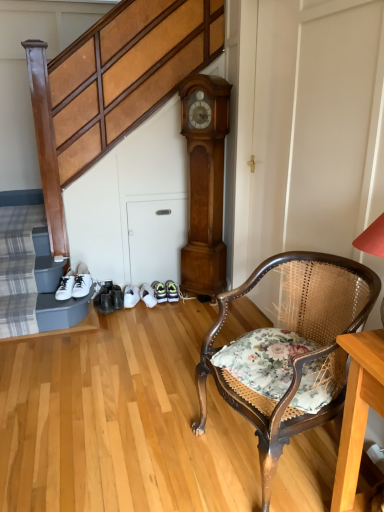
Question: In the image, is light brown wood clock at center positioned in front of or behind shiny black shoe at lower center?

Choices:
 (A) front
 (B) behind

Answer: (A)

Question: Is light brown wood clock at center inside or outside of shiny black shoe at lower center?

Choices:
 (A) outside
 (B) inside

Answer: (A)

Question: Considering the real-world distances, which object is closest to the light brown wood clock at center?

Choices:
 (A) floral fabric cushion at lower right
 (B) white leather sneakers at lower left
 (C) shiny black shoe at lower center
 (D) floral fabric chair at lower right

Answer: (C)

Question: Estimate the real-world distances between objects in this image. Which object is farther from the floral fabric cushion at lower right?

Choices:
 (A) light brown wood clock at center
 (B) shiny black shoe at lower center
 (C) floral fabric chair at lower right
 (D) white leather sneakers at lower left

Answer: (B)